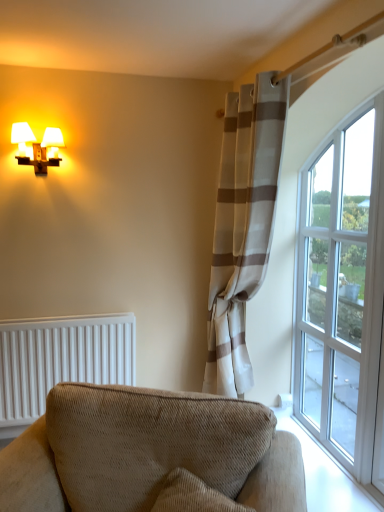
Question: Relative to beige striped curtain at right, is matte white sconce at upper left in front or behind?

Choices:
 (A) front
 (B) behind

Answer: (B)

Question: Visually, is matte white sconce at upper left positioned to the left or to the right of beige striped curtain at right?

Choices:
 (A) left
 (B) right

Answer: (A)

Question: Which is farther from the clear glass window at right?

Choices:
 (A) white textured radiator at lower left
 (B) beige corduroy couch at lower center
 (C) beige striped curtain at right
 (D) matte white sconce at upper left

Answer: (D)

Question: Which object is positioned farthest from the white textured radiator at lower left?

Choices:
 (A) beige corduroy couch at lower center
 (B) matte white sconce at upper left
 (C) clear glass window at right
 (D) beige striped curtain at right

Answer: (C)